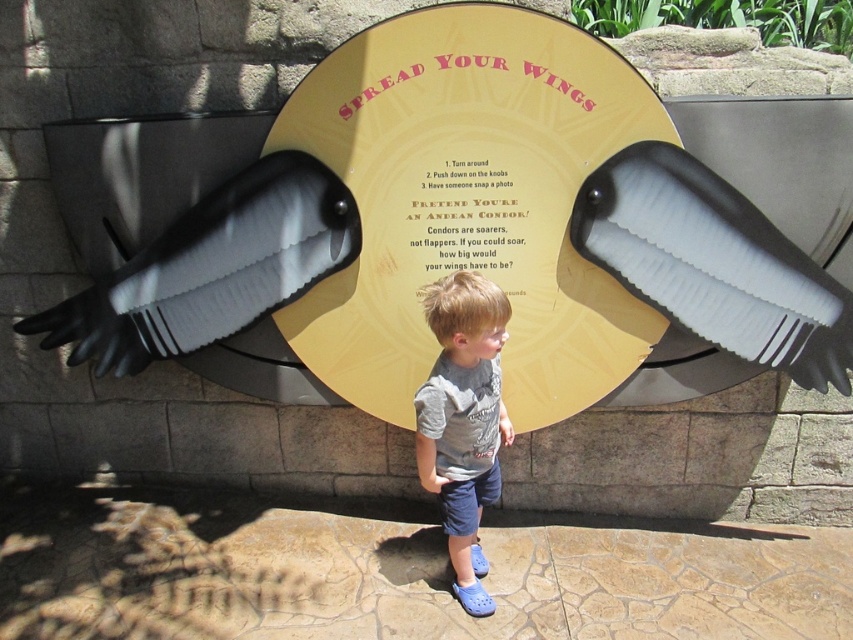
Question: Which object is the farthest from the black matte eagle at left?

Choices:
 (A) matte black wing at right
 (B) gray cotton shirt at center

Answer: (A)

Question: Which point appears farthest from the camera in this image?

Choices:
 (A) (526, 211)
 (B) (453, 492)
 (C) (163, 269)

Answer: (C)

Question: Estimate the real-world distances between objects in this image. Which object is closer to the black matte eagle at left?

Choices:
 (A) gray cotton shirt at center
 (B) matte black wing at right

Answer: (A)

Question: Where is matte yellow sign at center located in relation to black matte eagle at left in the image?

Choices:
 (A) above
 (B) below

Answer: (A)

Question: Can you confirm if black matte eagle at left is smaller than gray cotton shirt at center?

Choices:
 (A) yes
 (B) no

Answer: (B)

Question: Does matte black wing at right appear on the left side of gray cotton shirt at center?

Choices:
 (A) no
 (B) yes

Answer: (A)